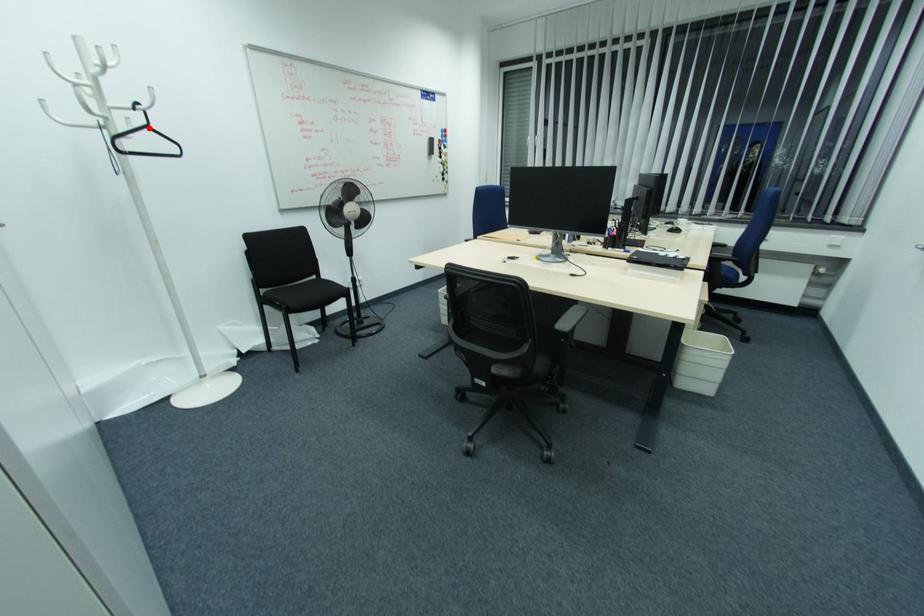
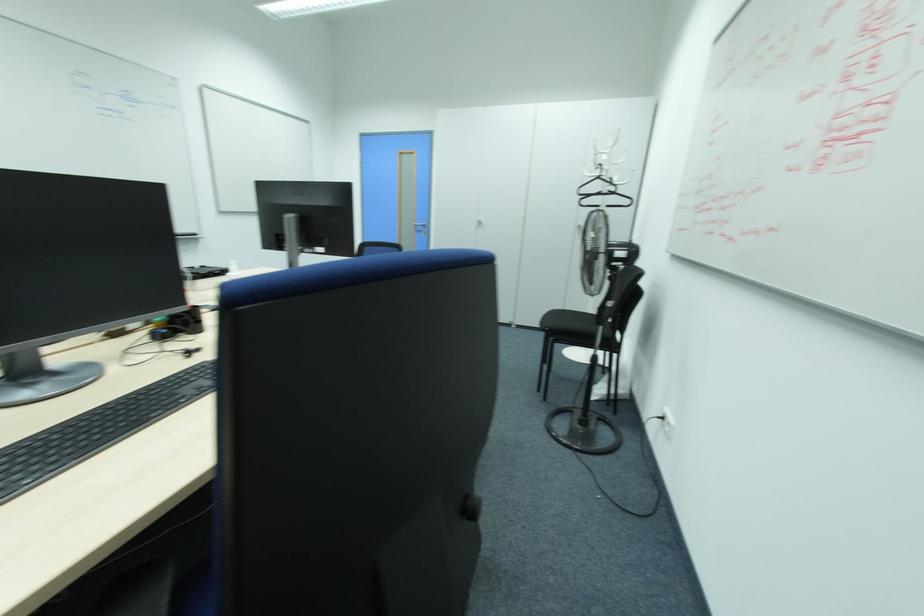
Locate, in the second image, the point that corresponds to the highlighted location in the first image.

(599, 177)